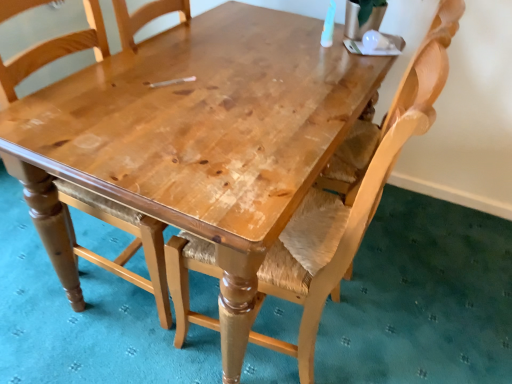
This screenshot has width=512, height=384. Describe the element at coordinates (92, 252) in the screenshot. I see `light brown wood chair at center, the 2th chair viewed from the right` at that location.

You are a GUI agent. You are given a task and a screenshot of the screen. Output one action in this format:
    pyautogui.click(x=<x>, y=<y>)
    Task: Click on the light brown wood chair at center, positioned as the 1th chair in left-to-right order
    
    Given the screenshot: What is the action you would take?
    pyautogui.click(x=92, y=252)

This screenshot has height=384, width=512. Identify the location of wooden chair with woven seat at center, the 1th chair when ordered from right to left. (351, 196).

This screenshot has width=512, height=384. What do you see at coordinates (351, 196) in the screenshot? I see `wooden chair with woven seat at center, the 2th chair from the left` at bounding box center [351, 196].

At what (x,y) coordinates should I click in order to perform the action: click on light brown wood chair at center, the 2th chair viewed from the right. Please return your answer as a coordinate pair (x, y). The image size is (512, 384). Looking at the image, I should click on (92, 252).

Considering the relative positions of light brown wood chair at center, the 2th chair viewed from the right, and wooden chair with woven seat at center, the 2th chair from the left, in the image provided, is light brown wood chair at center, the 2th chair viewed from the right, to the left or to the right of wooden chair with woven seat at center, the 2th chair from the left,?

light brown wood chair at center, the 2th chair viewed from the right, is positioned on wooden chair with woven seat at center, the 2th chair from the left,'s left side.

Does light brown wood chair at center, positioned as the 1th chair in left-to-right order, lie in front of wooden chair with woven seat at center, the 2th chair from the left?

No, light brown wood chair at center, positioned as the 1th chair in left-to-right order, is further to the viewer.

Considering the positions of point (119, 213) and point (185, 335), is point (119, 213) closer or farther from the camera than point (185, 335)?

Point (119, 213) appears to be closer to the viewer than point (185, 335).

Based on the photo, from the image's perspective, does light brown wood chair at center, the 2th chair viewed from the right, appear lower than wooden chair with woven seat at center, the 2th chair from the left?

No, from the image's perspective, light brown wood chair at center, the 2th chair viewed from the right, is not below wooden chair with woven seat at center, the 2th chair from the left.

From a real-world perspective, is light brown wood chair at center, positioned as the 1th chair in left-to-right order, positioned above or below wooden chair with woven seat at center, the 2th chair from the left?

In terms of real-world spatial position, light brown wood chair at center, positioned as the 1th chair in left-to-right order, is below wooden chair with woven seat at center, the 2th chair from the left.

Can you confirm if light brown wood chair at center, positioned as the 1th chair in left-to-right order, is thinner than wooden chair with woven seat at center, the 2th chair from the left?

Indeed, light brown wood chair at center, positioned as the 1th chair in left-to-right order, has a lesser width compared to wooden chair with woven seat at center, the 2th chair from the left.

Is light brown wood chair at center, positioned as the 1th chair in left-to-right order, taller than wooden chair with woven seat at center, the 1th chair when ordered from right to left?

Yes.

Who is smaller, light brown wood chair at center, the 2th chair viewed from the right, or wooden chair with woven seat at center, the 2th chair from the left?

light brown wood chair at center, the 2th chair viewed from the right, is smaller.

Choose the correct answer: Is light brown wood chair at center, the 2th chair viewed from the right, inside wooden chair with woven seat at center, the 1th chair when ordered from right to left, or outside it?

light brown wood chair at center, the 2th chair viewed from the right, is not inside wooden chair with woven seat at center, the 1th chair when ordered from right to left, it's outside.

Is light brown wood chair at center, positioned as the 1th chair in left-to-right order, placed right next to wooden chair with woven seat at center, the 2th chair from the left?

No, light brown wood chair at center, positioned as the 1th chair in left-to-right order, is not making contact with wooden chair with woven seat at center, the 2th chair from the left.

Is wooden chair with woven seat at center, the 1th chair when ordered from right to left, at the back of light brown wood chair at center, positioned as the 1th chair in left-to-right order?

Yes.

Can you tell me how much light brown wood chair at center, the 2th chair viewed from the right, and wooden chair with woven seat at center, the 2th chair from the left, differ in facing direction?

There is a 178-degree angle between the facing directions of light brown wood chair at center, the 2th chair viewed from the right, and wooden chair with woven seat at center, the 2th chair from the left.

Locate an element on the screen. chair that appears below the light brown wood chair at center, the 2th chair viewed from the right (from the image's perspective) is located at coordinates (351, 196).

Considering the relative positions of wooden chair with woven seat at center, the 2th chair from the left, and light brown wood chair at center, the 2th chair viewed from the right, in the image provided, is wooden chair with woven seat at center, the 2th chair from the left, to the right of light brown wood chair at center, the 2th chair viewed from the right, from the viewer's perspective?

Yes.

Is wooden chair with woven seat at center, the 2th chair from the left, closer to camera compared to light brown wood chair at center, positioned as the 1th chair in left-to-right order?

Yes, wooden chair with woven seat at center, the 2th chair from the left, is closer to the camera.

Which is behind, point (337, 164) or point (87, 29)?

The point (87, 29) is more distant.

From the image's perspective, which is above, wooden chair with woven seat at center, the 2th chair from the left, or light brown wood chair at center, positioned as the 1th chair in left-to-right order?

light brown wood chair at center, positioned as the 1th chair in left-to-right order, appears higher in the image.

From a real-world perspective, is wooden chair with woven seat at center, the 1th chair when ordered from right to left, below light brown wood chair at center, the 2th chair viewed from the right?

No.

Considering the relative sizes of wooden chair with woven seat at center, the 2th chair from the left, and light brown wood chair at center, the 2th chair viewed from the right, in the image provided, is wooden chair with woven seat at center, the 2th chair from the left, wider than light brown wood chair at center, the 2th chair viewed from the right,?

Yes.

Considering the relative sizes of wooden chair with woven seat at center, the 2th chair from the left, and light brown wood chair at center, positioned as the 1th chair in left-to-right order, in the image provided, is wooden chair with woven seat at center, the 2th chair from the left, shorter than light brown wood chair at center, positioned as the 1th chair in left-to-right order,?

Indeed, wooden chair with woven seat at center, the 2th chair from the left, has a lesser height compared to light brown wood chair at center, positioned as the 1th chair in left-to-right order.

Based on their sizes in the image, would you say wooden chair with woven seat at center, the 1th chair when ordered from right to left, is bigger or smaller than light brown wood chair at center, the 2th chair viewed from the right?

wooden chair with woven seat at center, the 1th chair when ordered from right to left, is bigger than light brown wood chair at center, the 2th chair viewed from the right.

Is light brown wood chair at center, positioned as the 1th chair in left-to-right order, a part of wooden chair with woven seat at center, the 1th chair when ordered from right to left?

No, wooden chair with woven seat at center, the 1th chair when ordered from right to left, does not contain light brown wood chair at center, positioned as the 1th chair in left-to-right order.

Is wooden chair with woven seat at center, the 2th chair from the left, next to light brown wood chair at center, the 2th chair viewed from the right, and touching it?

No, wooden chair with woven seat at center, the 2th chair from the left, is not with light brown wood chair at center, the 2th chair viewed from the right.

Is light brown wood chair at center, positioned as the 1th chair in left-to-right order, at the back of wooden chair with woven seat at center, the 2th chair from the left?

No, wooden chair with woven seat at center, the 2th chair from the left, is not facing the opposite direction of light brown wood chair at center, positioned as the 1th chair in left-to-right order.

Locate an element on the screen. Image resolution: width=512 pixels, height=384 pixels. chair below the wooden chair with woven seat at center, the 1th chair when ordered from right to left (from a real-world perspective) is located at coordinates (92, 252).

In order to click on chair behind the wooden chair with woven seat at center, the 1th chair when ordered from right to left in this screenshot , I will do `click(92, 252)`.

Locate an element on the screen. Image resolution: width=512 pixels, height=384 pixels. chair below the wooden chair with woven seat at center, the 2th chair from the left (from a real-world perspective) is located at coordinates pyautogui.click(x=92, y=252).